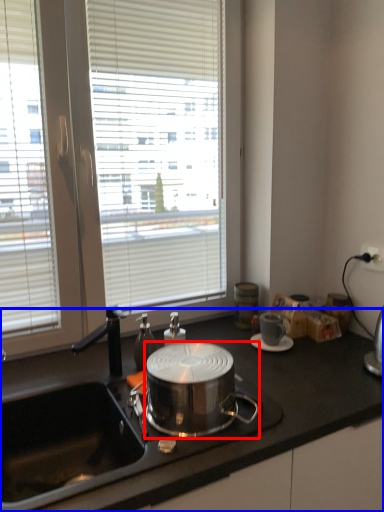
Question: Which point is further to the camera, kitchen appliance (highlighted by a red box) or countertop (highlighted by a blue box)?

Choices:
 (A) kitchen appliance
 (B) countertop

Answer: (A)